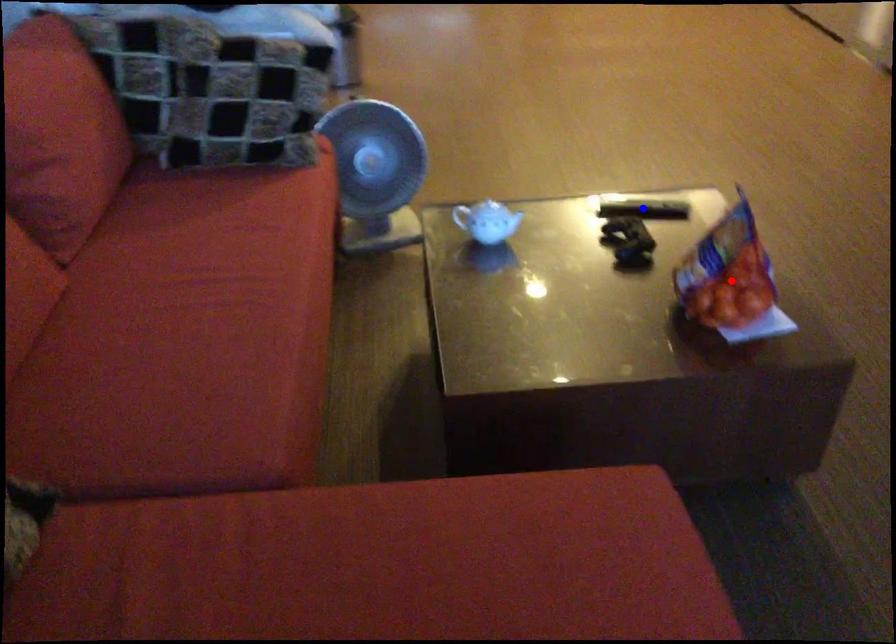
Question: In the image, two points are highlighted. Which point is nearer to the camera? Reply with the corresponding letter.

Choices:
 (A) blue point
 (B) red point

Answer: (B)